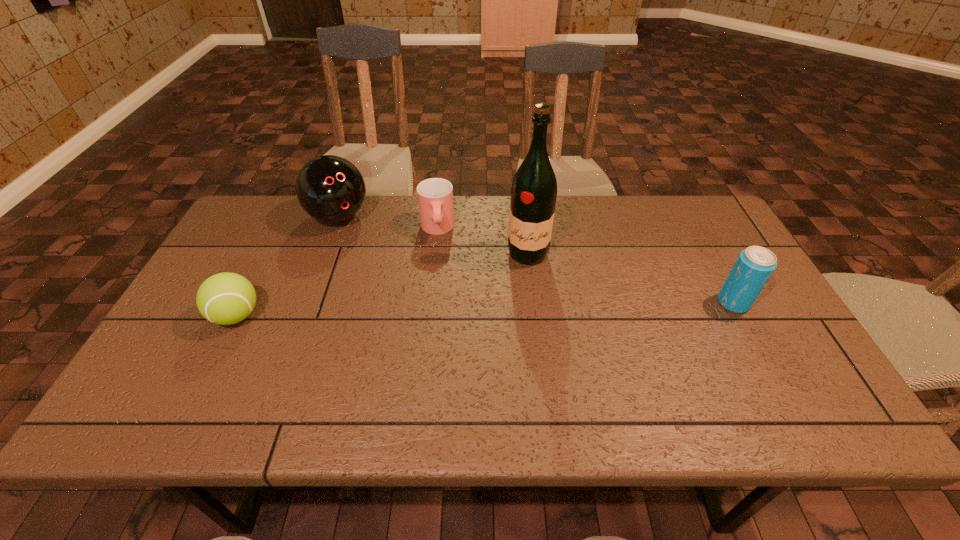
Where is `vacant space located on the front-facing side of the fourth object from left to right`? The height and width of the screenshot is (540, 960). vacant space located on the front-facing side of the fourth object from left to right is located at coordinates (516, 325).

What are the coordinates of `vacant area located 0.330m on the front-facing side of the fourth object from left to right` in the screenshot? It's located at (511, 364).

Locate an element on the screen. The height and width of the screenshot is (540, 960). free space located on the front-facing side of the fourth object from left to right is located at coordinates (511, 364).

Identify the location of free space located 0.240m on the side of the third object from left to right with the handle. This screenshot has width=960, height=540. (444, 305).

Where is `free region located 0.250m on the side of the third object from left to right with the handle`? The height and width of the screenshot is (540, 960). free region located 0.250m on the side of the third object from left to right with the handle is located at coordinates (444, 308).

This screenshot has height=540, width=960. I want to click on free location located 0.320m on the side of the third object from left to right with the handle, so click(x=446, y=329).

Where is `free region located 0.230m on the surface of the second tallest object near the finger holes`? The width and height of the screenshot is (960, 540). free region located 0.230m on the surface of the second tallest object near the finger holes is located at coordinates (387, 275).

I want to click on vacant region located 0.150m on the surface of the second tallest object near the finger holes, so click(x=374, y=260).

The image size is (960, 540). I want to click on vacant space located on the surface of the second tallest object near the finger holes, so click(379, 266).

You are a GUI agent. You are given a task and a screenshot of the screen. Output one action in this format:
    pyautogui.click(x=<x>, y=<y>)
    Task: Click on the liquor that is at the far edge
    
    Given the screenshot: What is the action you would take?
    pyautogui.click(x=534, y=189)